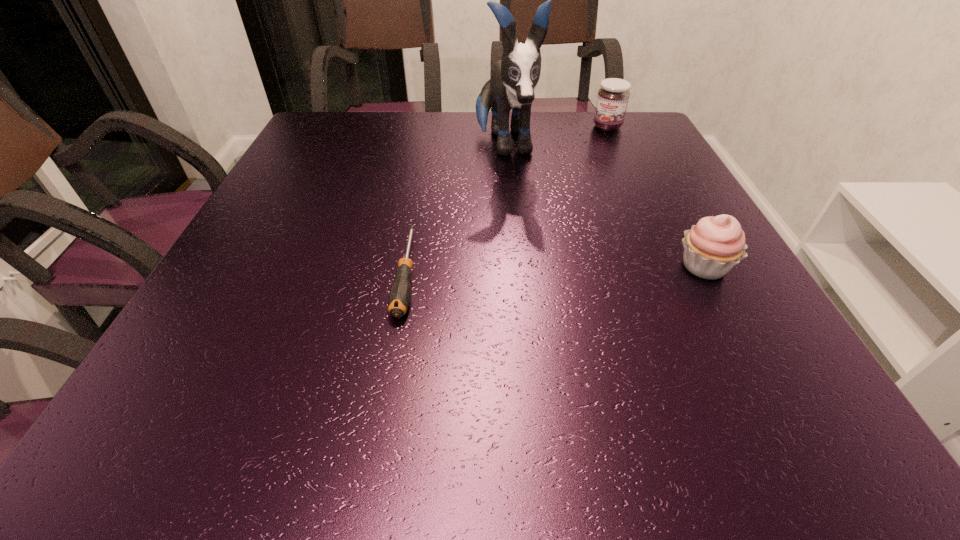
Identify the location of screwdriver. The height and width of the screenshot is (540, 960). pyautogui.click(x=399, y=297).

Where is `the leftmost object`? This screenshot has width=960, height=540. the leftmost object is located at coordinates (399, 297).

You are a GUI agent. You are given a task and a screenshot of the screen. Output one action in this format:
    pyautogui.click(x=<x>, y=<y>)
    Task: Click on the cupcake
    Image resolution: width=960 pixels, height=540 pixels.
    Given the screenshot: What is the action you would take?
    pyautogui.click(x=714, y=245)

I want to click on jam, so click(612, 100).

In order to click on puppy in this screenshot , I will do `click(514, 78)`.

Identify the location of the third object from right to left. This screenshot has height=540, width=960. (514, 78).

What are the coordinates of `vacant space situated at the tip of the screwdriver` in the screenshot? It's located at (393, 352).

The height and width of the screenshot is (540, 960). I want to click on vacant space located on the left of the cupcake, so click(551, 267).

Where is `vacant region located 0.240m on the front label of the jam`? This screenshot has width=960, height=540. vacant region located 0.240m on the front label of the jam is located at coordinates [x=583, y=174].

At what (x,y) coordinates should I click in order to perform the action: click on free space located on the front label of the jam. Please return your answer as a coordinate pair (x, y). Looking at the image, I should click on (578, 183).